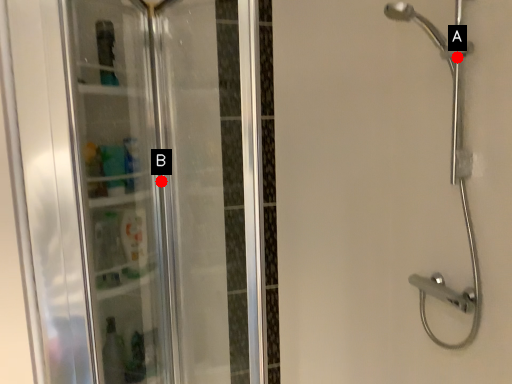
Question: Two points are circled on the image, labeled by A and B beside each circle. Among these points, which one is farthest from the camera?

Choices:
 (A) A is further
 (B) B is further

Answer: (A)